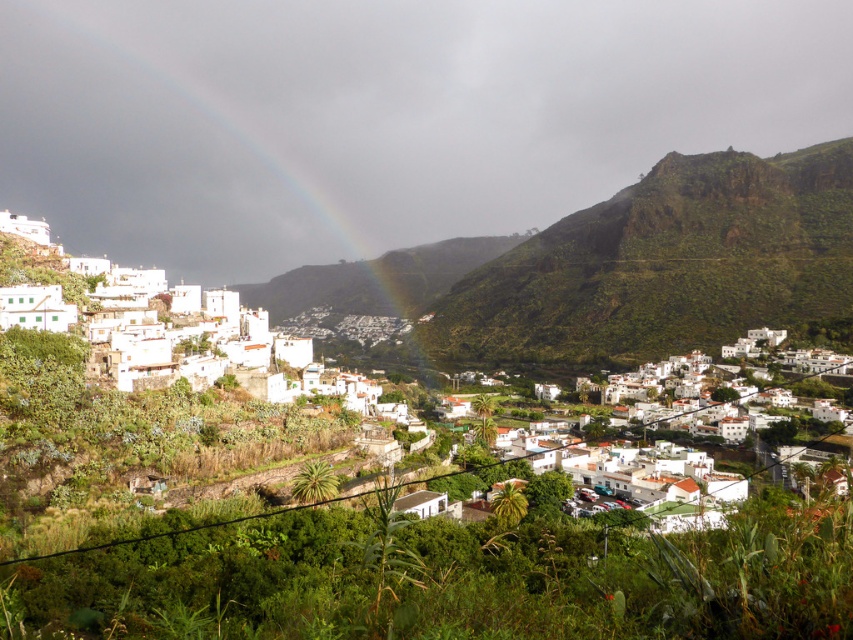
Question: Which point is farther to the camera?

Choices:
 (A) (335, 444)
 (B) (73, 19)

Answer: (B)

Question: Which point is farther to the camera?

Choices:
 (A) (576, 72)
 (B) (296, 438)

Answer: (A)

Question: Is rainbow at left positioned behind white matte houses at center?

Choices:
 (A) no
 (B) yes

Answer: (B)

Question: From the image, what is the correct spatial relationship of rainbow at left in relation to white matte houses at center?

Choices:
 (A) right
 (B) left

Answer: (B)

Question: Is rainbow at left closer to the viewer compared to white matte houses at center?

Choices:
 (A) no
 (B) yes

Answer: (A)